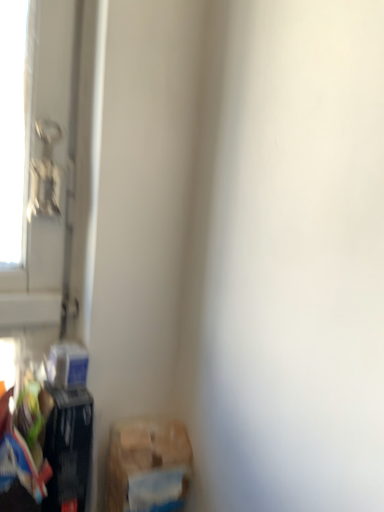
The width and height of the screenshot is (384, 512). What do you see at coordinates (148, 466) in the screenshot?
I see `brown cardboard box at lower left, positioned as the first waste in right-to-left order` at bounding box center [148, 466].

I want to click on brown cardboard box at lower left, positioned as the 2th waste in left-to-right order, so click(x=148, y=466).

In the scene shown: How much space does brown cardboard box at lower left, positioned as the first waste in right-to-left order, occupy vertically?

brown cardboard box at lower left, positioned as the first waste in right-to-left order, is 7.85 inches in height.

Image resolution: width=384 pixels, height=512 pixels. What do you see at coordinates (59, 456) in the screenshot? I see `matte black trash can at lower left, marked as the first waste in a left-to-right arrangement` at bounding box center [59, 456].

Where is `matte black trash can at lower left, marked as the first waste in a left-to-right arrangement`? matte black trash can at lower left, marked as the first waste in a left-to-right arrangement is located at coordinates (59, 456).

Image resolution: width=384 pixels, height=512 pixels. Find the location of `brown cardboard box at lower left, positioned as the first waste in right-to-left order`. brown cardboard box at lower left, positioned as the first waste in right-to-left order is located at coordinates (148, 466).

Is brown cardboard box at lower left, positioned as the first waste in right-to-left order, at the left side of matte black trash can at lower left, marked as the first waste in a left-to-right arrangement?

In fact, brown cardboard box at lower left, positioned as the first waste in right-to-left order, is to the right of matte black trash can at lower left, marked as the first waste in a left-to-right arrangement.

Does brown cardboard box at lower left, positioned as the 2th waste in left-to-right order, come behind matte black trash can at lower left, marked as the second waste in a right-to-left arrangement?

No, it is in front of matte black trash can at lower left, marked as the second waste in a right-to-left arrangement.

Considering the positions of point (163, 476) and point (70, 490), is point (163, 476) closer or farther from the camera than point (70, 490)?

Point (163, 476) is farther from the camera than point (70, 490).

From the image's perspective, is brown cardboard box at lower left, positioned as the first waste in right-to-left order, located above or below matte black trash can at lower left, marked as the second waste in a right-to-left arrangement?

From the image's perspective, brown cardboard box at lower left, positioned as the first waste in right-to-left order, appears below matte black trash can at lower left, marked as the second waste in a right-to-left arrangement.

From a real-world perspective, is brown cardboard box at lower left, positioned as the 2th waste in left-to-right order, beneath matte black trash can at lower left, marked as the first waste in a left-to-right arrangement?

Indeed, from a real-world perspective, brown cardboard box at lower left, positioned as the 2th waste in left-to-right order, is positioned beneath matte black trash can at lower left, marked as the first waste in a left-to-right arrangement.

Considering the relative sizes of brown cardboard box at lower left, positioned as the first waste in right-to-left order, and matte black trash can at lower left, marked as the first waste in a left-to-right arrangement, in the image provided, is brown cardboard box at lower left, positioned as the first waste in right-to-left order, wider than matte black trash can at lower left, marked as the first waste in a left-to-right arrangement,?

In fact, brown cardboard box at lower left, positioned as the first waste in right-to-left order, might be narrower than matte black trash can at lower left, marked as the first waste in a left-to-right arrangement.

Does brown cardboard box at lower left, positioned as the first waste in right-to-left order, have a greater height compared to matte black trash can at lower left, marked as the second waste in a right-to-left arrangement?

Incorrect, the height of brown cardboard box at lower left, positioned as the first waste in right-to-left order, is not larger of that of matte black trash can at lower left, marked as the second waste in a right-to-left arrangement.

Considering the sizes of objects brown cardboard box at lower left, positioned as the 2th waste in left-to-right order, and matte black trash can at lower left, marked as the second waste in a right-to-left arrangement, in the image provided, who is smaller, brown cardboard box at lower left, positioned as the 2th waste in left-to-right order, or matte black trash can at lower left, marked as the second waste in a right-to-left arrangement,?

Smaller between the two is matte black trash can at lower left, marked as the second waste in a right-to-left arrangement.

Is brown cardboard box at lower left, positioned as the first waste in right-to-left order, inside the boundaries of matte black trash can at lower left, marked as the first waste in a left-to-right arrangement, or outside?

brown cardboard box at lower left, positioned as the first waste in right-to-left order, is not inside matte black trash can at lower left, marked as the first waste in a left-to-right arrangement, it's outside.

Is there a large distance between brown cardboard box at lower left, positioned as the first waste in right-to-left order, and matte black trash can at lower left, marked as the first waste in a left-to-right arrangement?

Actually, brown cardboard box at lower left, positioned as the first waste in right-to-left order, and matte black trash can at lower left, marked as the first waste in a left-to-right arrangement, are a little close together.

Is brown cardboard box at lower left, positioned as the first waste in right-to-left order, aimed at matte black trash can at lower left, marked as the first waste in a left-to-right arrangement?

No, brown cardboard box at lower left, positioned as the first waste in right-to-left order, is not turned towards matte black trash can at lower left, marked as the first waste in a left-to-right arrangement.

The image size is (384, 512). What are the coordinates of `waste on the right of matte black trash can at lower left, marked as the second waste in a right-to-left arrangement` in the screenshot? It's located at (148, 466).

Does matte black trash can at lower left, marked as the second waste in a right-to-left arrangement, appear on the right side of brown cardboard box at lower left, positioned as the 2th waste in left-to-right order?

Incorrect, matte black trash can at lower left, marked as the second waste in a right-to-left arrangement, is not on the right side of brown cardboard box at lower left, positioned as the 2th waste in left-to-right order.

Relative to brown cardboard box at lower left, positioned as the 2th waste in left-to-right order, is matte black trash can at lower left, marked as the second waste in a right-to-left arrangement, in front or behind?

In the image, matte black trash can at lower left, marked as the second waste in a right-to-left arrangement, appears behind brown cardboard box at lower left, positioned as the 2th waste in left-to-right order.

Considering the positions of point (48, 407) and point (141, 452), is point (48, 407) closer or farther from the camera than point (141, 452)?

Point (48, 407) appears to be closer to the viewer than point (141, 452).

From the image's perspective, which object appears higher, matte black trash can at lower left, marked as the first waste in a left-to-right arrangement, or brown cardboard box at lower left, positioned as the first waste in right-to-left order?

matte black trash can at lower left, marked as the first waste in a left-to-right arrangement, appears higher in the image.

In the scene shown: From a real-world perspective, does matte black trash can at lower left, marked as the first waste in a left-to-right arrangement, sit lower than brown cardboard box at lower left, positioned as the 2th waste in left-to-right order?

No.

Can you confirm if matte black trash can at lower left, marked as the second waste in a right-to-left arrangement, is wider than brown cardboard box at lower left, positioned as the 2th waste in left-to-right order?

Yes, matte black trash can at lower left, marked as the second waste in a right-to-left arrangement, is wider than brown cardboard box at lower left, positioned as the 2th waste in left-to-right order.

Which of these two, matte black trash can at lower left, marked as the second waste in a right-to-left arrangement, or brown cardboard box at lower left, positioned as the first waste in right-to-left order, stands shorter?

brown cardboard box at lower left, positioned as the first waste in right-to-left order, is shorter.

Looking at this image, between matte black trash can at lower left, marked as the first waste in a left-to-right arrangement, and brown cardboard box at lower left, positioned as the 2th waste in left-to-right order, which one has smaller size?

matte black trash can at lower left, marked as the first waste in a left-to-right arrangement.

Would you say matte black trash can at lower left, marked as the first waste in a left-to-right arrangement, is outside brown cardboard box at lower left, positioned as the 2th waste in left-to-right order?

matte black trash can at lower left, marked as the first waste in a left-to-right arrangement, is positioned outside brown cardboard box at lower left, positioned as the 2th waste in left-to-right order.

Does matte black trash can at lower left, marked as the second waste in a right-to-left arrangement, touch brown cardboard box at lower left, positioned as the 2th waste in left-to-right order?

They are not placed beside each other.

Is matte black trash can at lower left, marked as the second waste in a right-to-left arrangement, oriented away from brown cardboard box at lower left, positioned as the first waste in right-to-left order?

matte black trash can at lower left, marked as the second waste in a right-to-left arrangement, is not turned away from brown cardboard box at lower left, positioned as the first waste in right-to-left order.

What's the angular difference between matte black trash can at lower left, marked as the first waste in a left-to-right arrangement, and brown cardboard box at lower left, positioned as the 2th waste in left-to-right order,'s facing directions?

4.25 degrees.

Where is `waste that is on the right side of matte black trash can at lower left, marked as the second waste in a right-to-left arrangement`? This screenshot has width=384, height=512. waste that is on the right side of matte black trash can at lower left, marked as the second waste in a right-to-left arrangement is located at coordinates (148, 466).

Where is `waste below the matte black trash can at lower left, marked as the second waste in a right-to-left arrangement (from a real-world perspective)`? The width and height of the screenshot is (384, 512). waste below the matte black trash can at lower left, marked as the second waste in a right-to-left arrangement (from a real-world perspective) is located at coordinates (148, 466).

Locate an element on the screen. The image size is (384, 512). waste in front of the matte black trash can at lower left, marked as the first waste in a left-to-right arrangement is located at coordinates (148, 466).